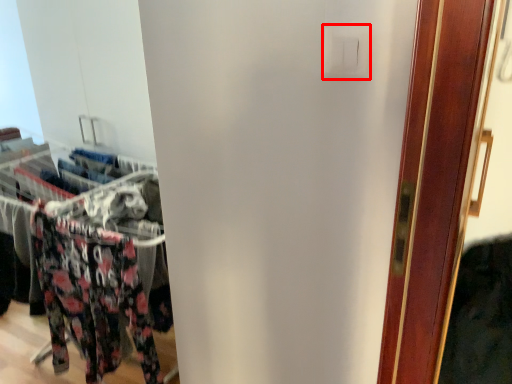
Question: From the image, what is the correct spatial relationship of light switch (annotated by the red box) in relation to closet?

Choices:
 (A) left
 (B) right

Answer: (B)